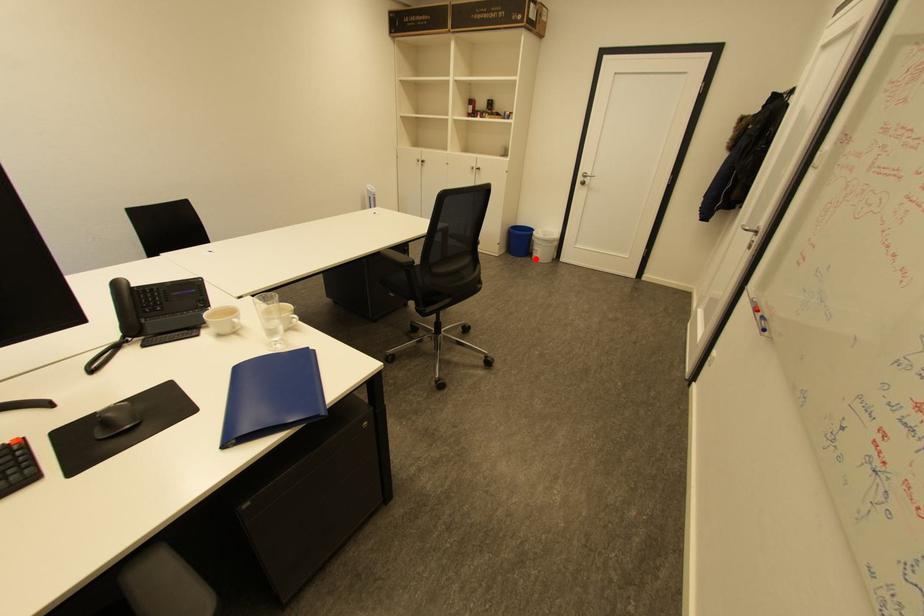
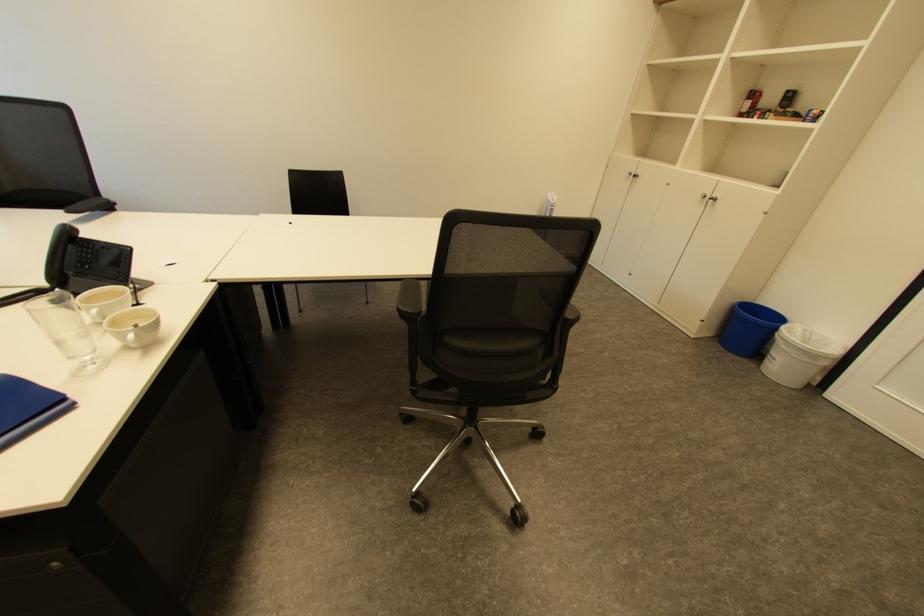
Find the pixel in the second image that matches the highlighted location in the first image.

(760, 365)